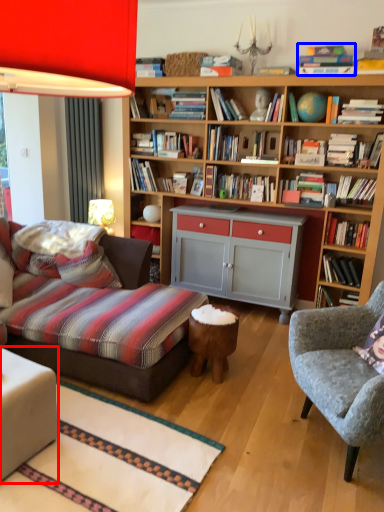
Question: Which of the following is the farthest to the observer, table (highlighted by a red box) or book (highlighted by a blue box)?

Choices:
 (A) table
 (B) book

Answer: (B)